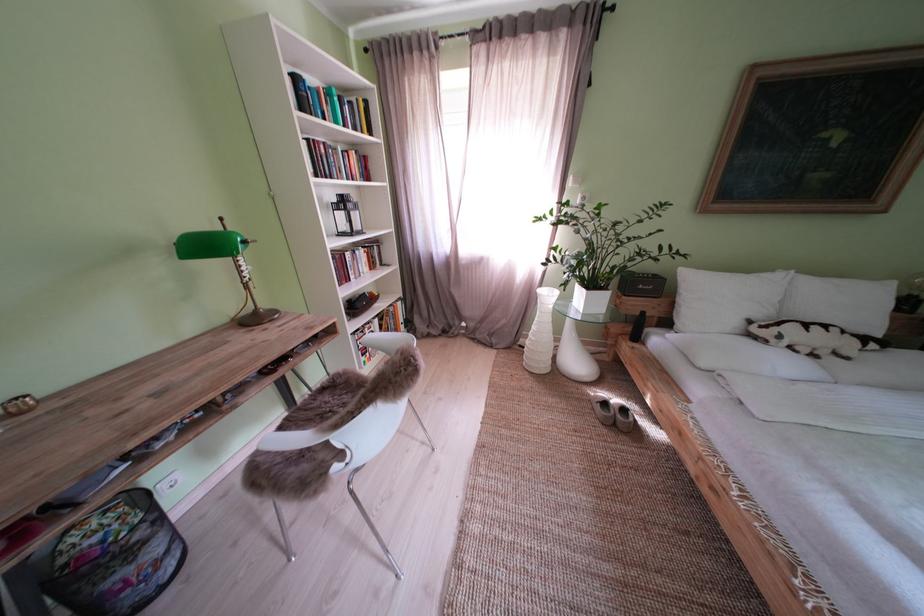
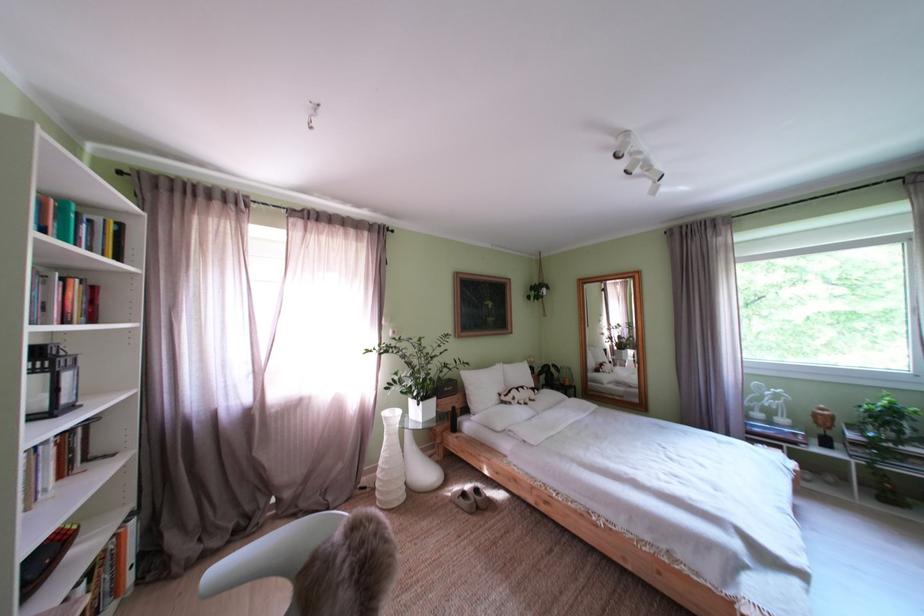
In the second image, find the point that corresponds to (x=616, y=408) in the first image.

(475, 500)